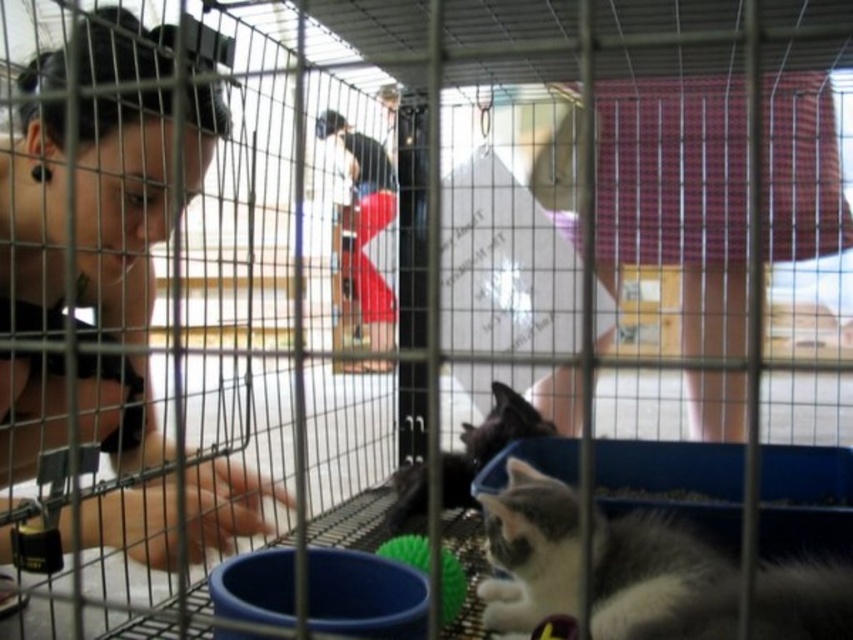
You are a volunteer at the animal shelter and need to clean the cage. The cage has a small opening. The opening is 50 centimeters wide. Can you fit the cleaning tools through the opening while keeping the matte black hair at left and the black fur cat at lower center separated?

The matte black hair at left and black fur cat at lower center are 50.29 centimeters apart. The opening is only 50 centimeters wide, so the tools cannot fit through without potentially disturbing their separation.

You are standing at the entrance of the animal shelter and want to place a small toy between the two points marked as point (517, 605) and point (451, 488). Which point should you place the toy closer to so that it is in front of the other point?

You should place the toy closer to point (517, 605) because it is in front of point (451, 488).